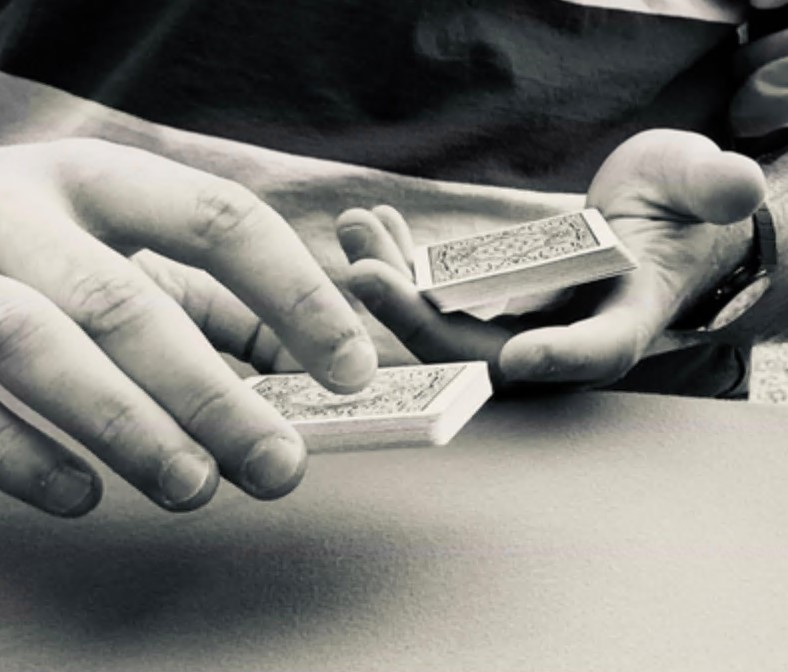
Identify the location of stack of poker cards. (395, 416), (515, 259).